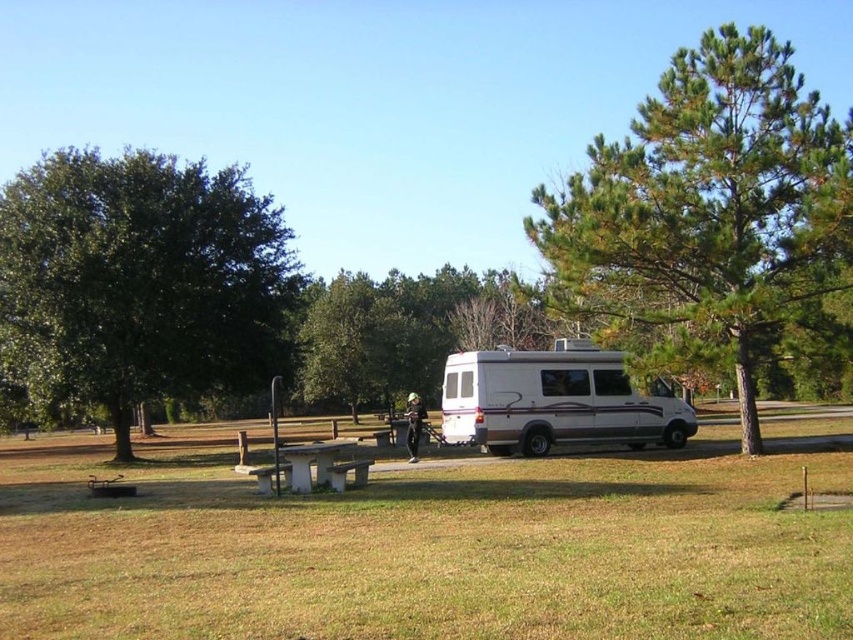
You are planning to set up a tent in this campground. The wooden park bench at center is in the way. Can you move the bench to the location where the green leafy tree at right is currently standing?

The green leafy tree at right is taller than the wooden park bench at center, so moving the bench to the tree location would not be possible because the tree occupies that space and is taller, making it an obstacle.

You are standing at the picnic table with a bench in the foreground. There is a green leafy tree at right represented by point (x=706, y=211). Which direction should you face to see the green leafy tree at right?

The green leafy tree at right is located at point (x=706, y=211), which is to the right side of the image. Therefore, you should face towards the right direction to see the green leafy tree at right.

Based on the photo, you are planning to set up a tent in this area. Considering the green leafy tree at center and the white plastic picnic table at center, which object would provide more shade for your tent?

The green leafy tree at center has a larger size compared to the white plastic picnic table at center, so it would provide more shade for your tent.